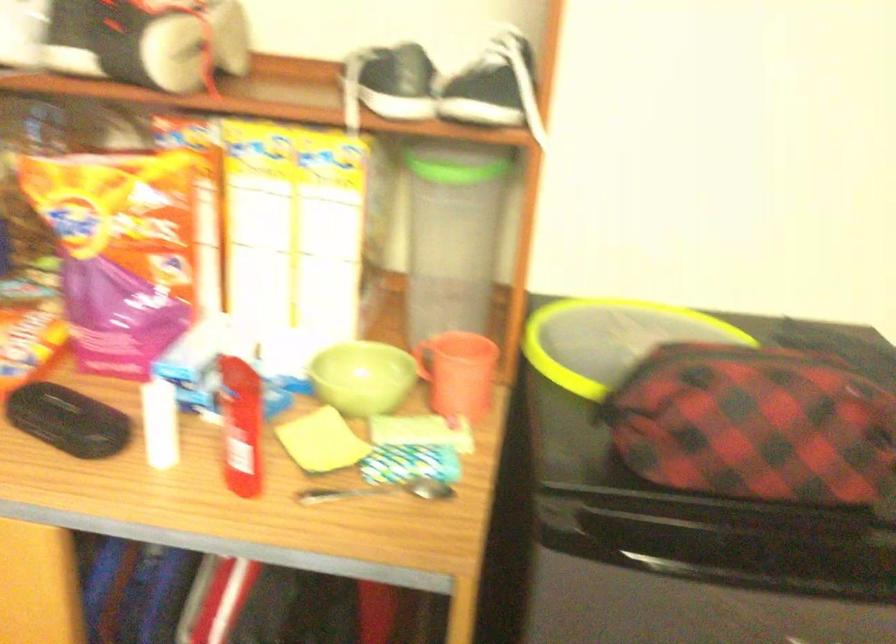
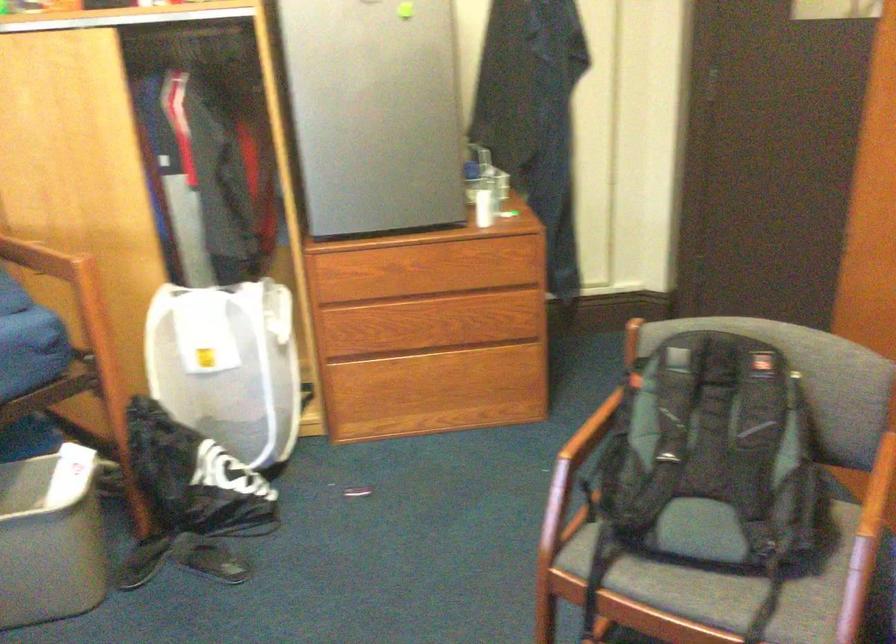
Question: What movement of the cameraman would produce the second image?

Choices:
 (A) Left
 (B) Right
 (C) Forward
 (D) Backward

Answer: (D)